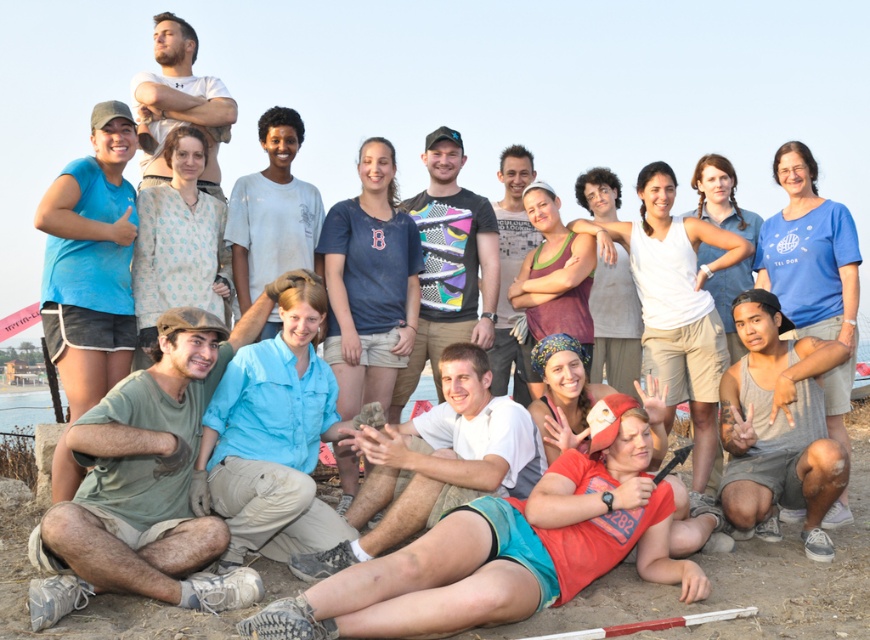
You are organizing a photo shoot and need to ensure that the light blue shirt at center and the light brown textured shirt at center are visible in the final image. Given their sizes, which of these two shirts should be placed closer to the camera to ensure both are equally visible?

The light brown textured shirt at center is smaller than the light blue shirt at center. To make both shirts appear equally visible in the photo, the smaller light brown textured shirt at center should be placed closer to the camera.

You are organizing a clothing donation drive and need to categorize shirts based on their sizes. You have a green cotton shirt at lower left and a gray tank top at lower right. Which shirt has a larger width?

The green cotton shirt at lower left has a larger width than the gray tank top at lower right.

You are organizing a photo shoot and need to ensure that the light blue shirt at center and the light brown textured shirt at center are visible in the frame. Given that the camera has a fixed width of 1.2 meters, can both shirts fit side by side within the camera frame?

The light blue shirt at center is wider than the light brown textured shirt at center. However, without knowing the exact widths of both shirts, it is impossible to determine if their combined width exceeds the camera frame of 1.2 meters. Additional measurements are required.